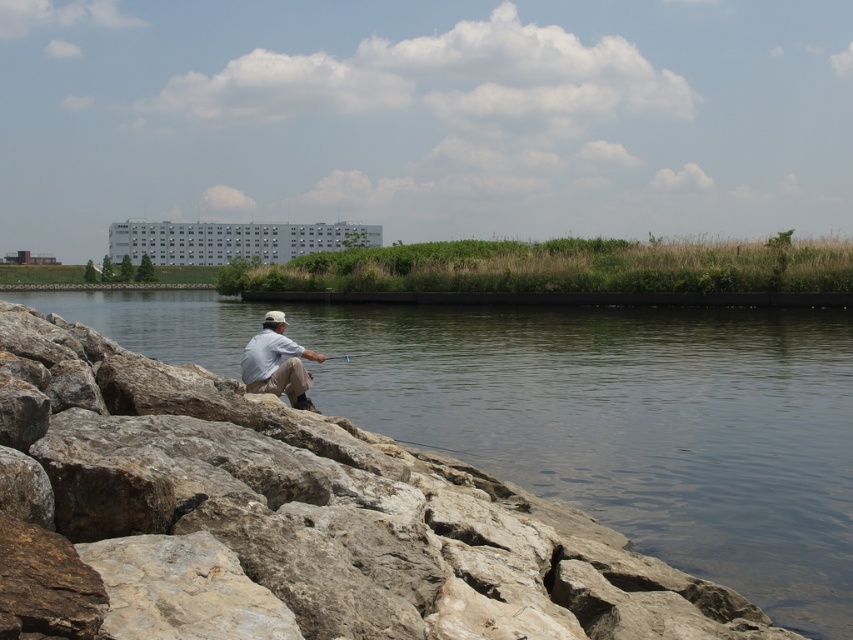
You are standing on the rocky shore and want to step onto the clear water at lower left to reach the light blue cotton shirt at center. Is this possible?

The clear water at lower left is much taller than the light blue cotton shirt at center. Since water is a liquid and cannot support weight, stepping onto it would not be possible.

You are standing at the center of the image and want to walk to the clear water at lower left. Which direction should you move to reach it?

To reach the clear water at lower left, you should move towards the lower left direction since its 2D location is at point (633, 426).

You are standing at the edge of the water and want to place a small floating toy boat in the clear water at lower left. The boat requires at least as much space as the light blue cotton shirt at center to float. Will there be enough space?

The clear water at lower left has a larger width than the light blue cotton shirt at center, so there is enough space for the boat to float.